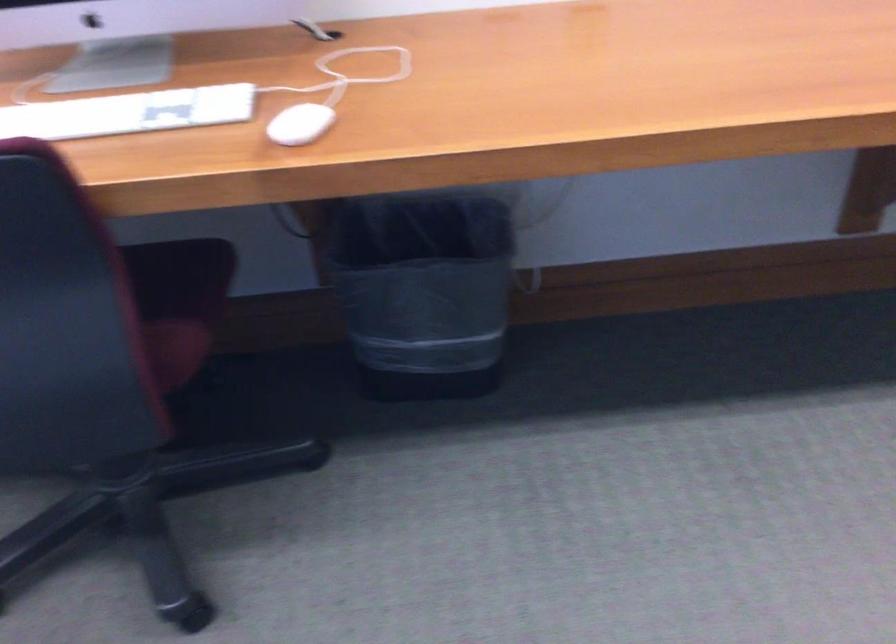
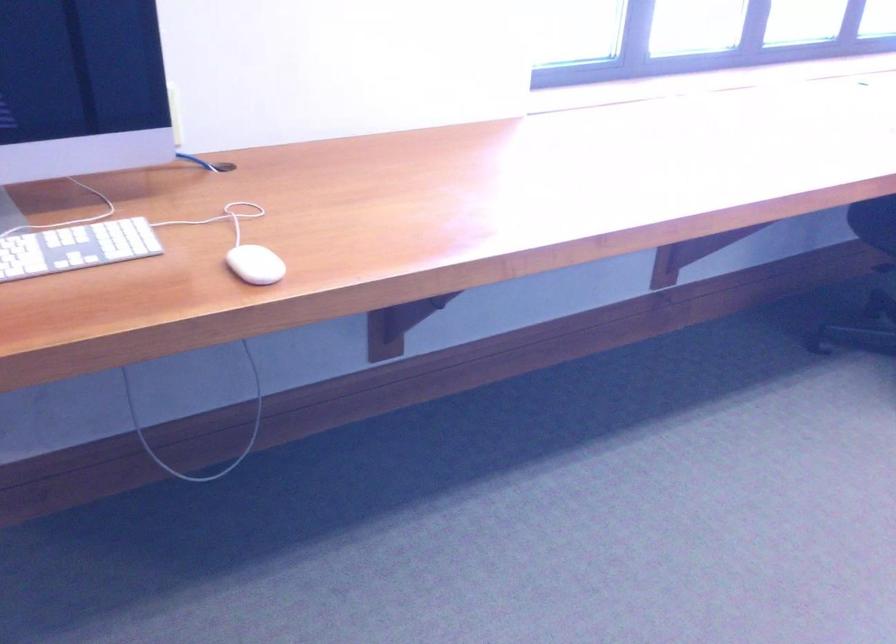
Question: What movement of the cameraman would produce the second image?

Choices:
 (A) Left
 (B) Right
 (C) Forward
 (D) Backward

Answer: (A)